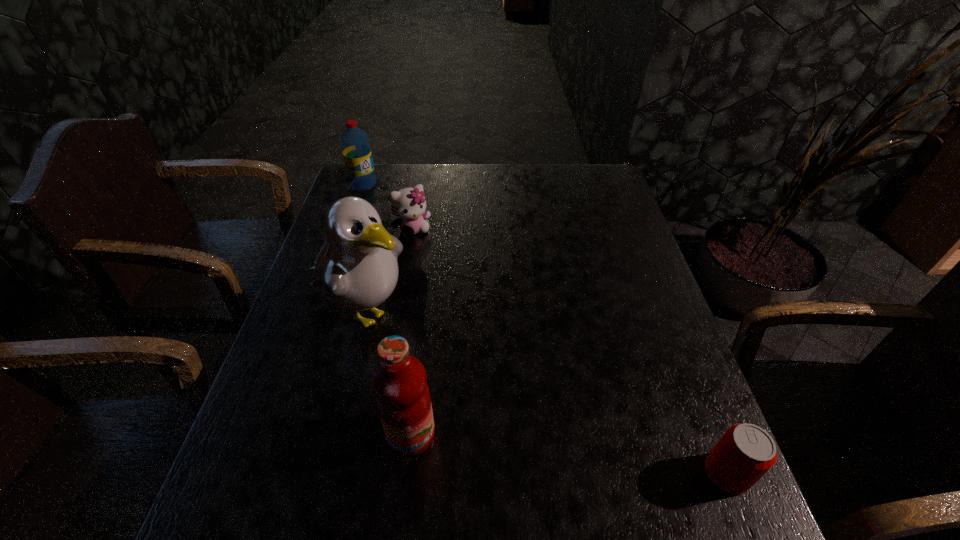
At what (x,y) coordinates should I click in order to perform the action: click on free space at the far right corner of the desktop. Please return your answer as a coordinate pair (x, y). The height and width of the screenshot is (540, 960). Looking at the image, I should click on (580, 186).

Find the location of a particular element. The image size is (960, 540). free space between the rightmost object and the second tallest object is located at coordinates (569, 454).

What are the coordinates of `free point between the rightmost object and the second tallest object` in the screenshot? It's located at (569, 454).

The image size is (960, 540). I want to click on unoccupied position between the fourth nearest object and the fruit juice, so click(412, 332).

The height and width of the screenshot is (540, 960). I want to click on free space that is in between the second shortest object and the water bottle, so click(388, 207).

Find the location of a particular element. vacant space that is in between the fruit juice and the fourth nearest object is located at coordinates (412, 332).

Find the location of `unoccupied area between the beer can and the fourth nearest object`. unoccupied area between the beer can and the fourth nearest object is located at coordinates (569, 352).

This screenshot has height=540, width=960. I want to click on free space between the water bottle and the beer can, so click(x=545, y=329).

Identify which object is located as the nearest to the kitten. Please provide its 2D coordinates. Your answer should be formatted as a tuple, i.e. [(x, y)], where the tuple contains the x and y coordinates of a point satisfying the conditions above.

[(356, 269)]

Identify which object is located as the second nearest to the beer can. Please provide its 2D coordinates. Your answer should be formatted as a tuple, i.e. [(x, y)], where the tuple contains the x and y coordinates of a point satisfying the conditions above.

[(356, 269)]